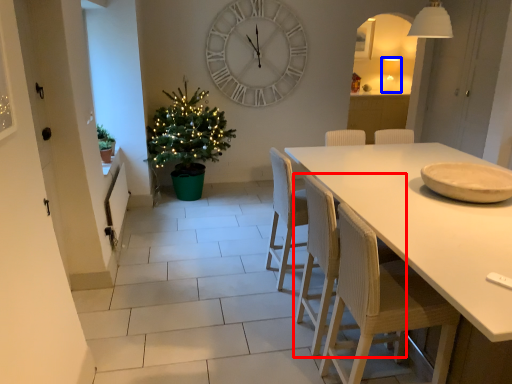
Question: Among these objects, which one is farthest to the camera, chair (highlighted by a red box) or lamp (highlighted by a blue box)?

Choices:
 (A) chair
 (B) lamp

Answer: (B)